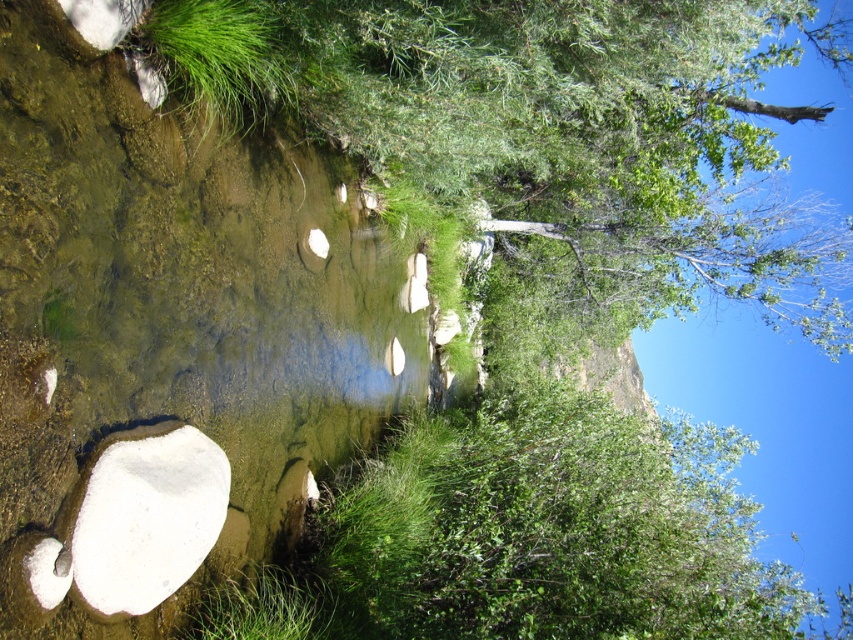
You are standing at the center of the stream and want to reach the green leafy grass at upper left. Which direction should you move to get there?

Since the green leafy grass at upper left is located at point coordinates indicating it is in the upper left direction from your current position at the stream center, you should move towards the upper left direction to reach it.

You are standing at the edge of the stream and want to find the green leafy tree at center. Which direction should you look relative to the green leafy grass at upper left?

The green leafy tree at center is located below the green leafy grass at upper left, so you should look downward from the green leafy grass at upper left to find it.

You are standing at the edge of the stream and want to determine which object is taller between the green leafy tree at center and the green leafy grass at upper left. Based on the scene, which one is taller?

The green leafy tree at center is taller than the green leafy grass at upper left.